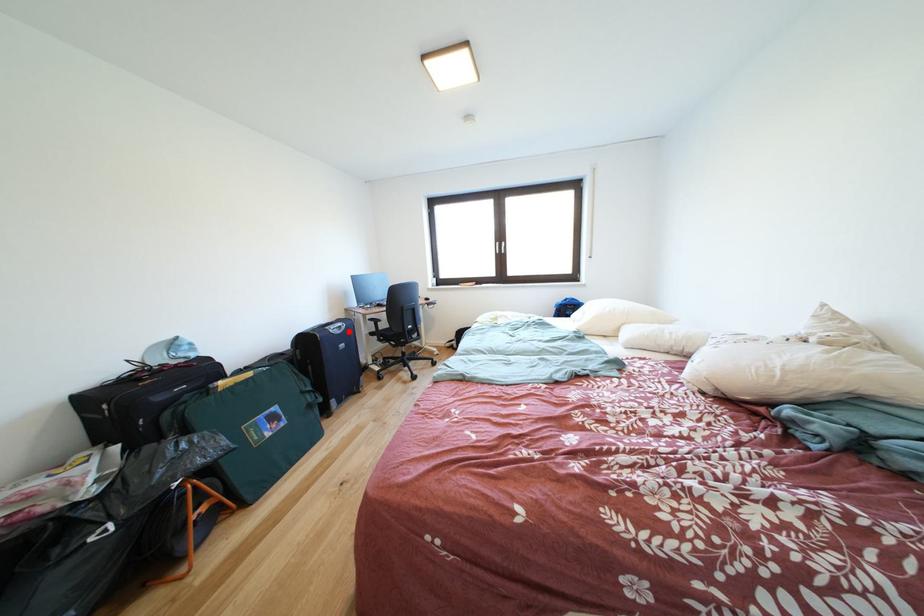
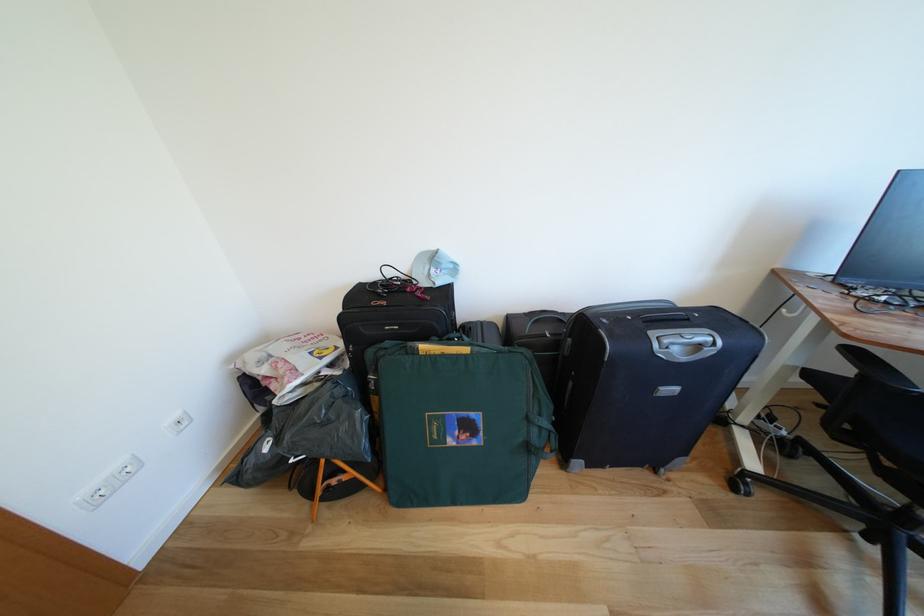
Question: I am providing you with two images of the same scene from different viewpoints. Given a red point in image1, look at the same physical point in image2. Is it:

Choices:
 (A) Closer to the viewpoint
 (B) Farther from the viewpoint

Answer: (B)